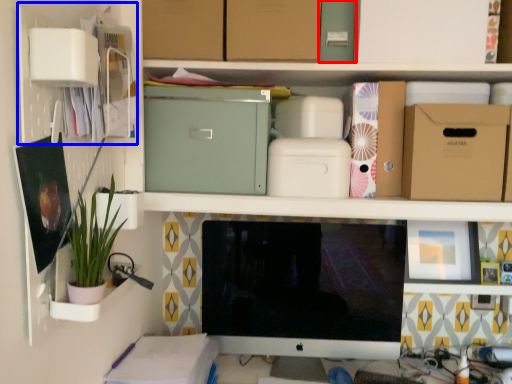
Question: Which object appears closest to the camera in this image, storage box (highlighted by a red box) or cabinet (highlighted by a blue box)?

Choices:
 (A) storage box
 (B) cabinet

Answer: (B)